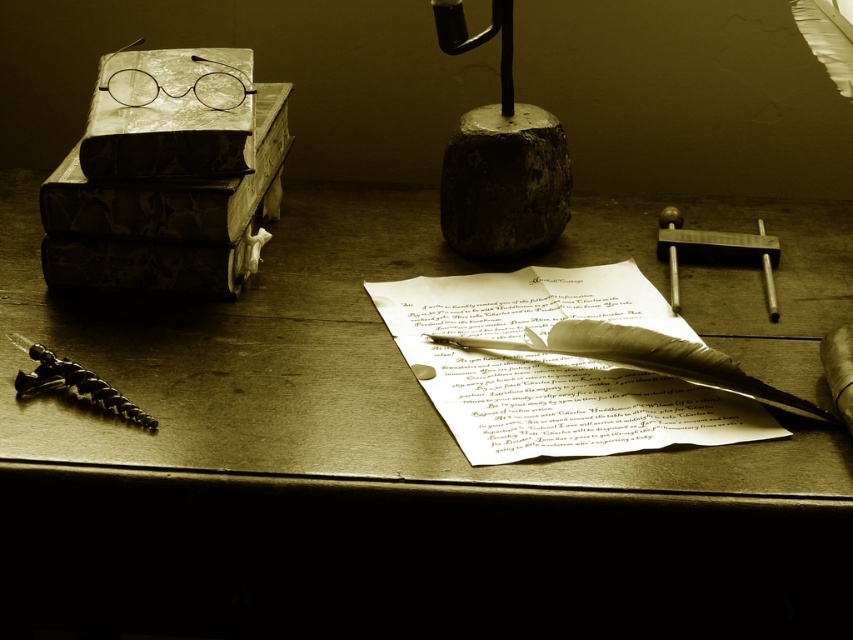
Question: Which of the following is the farthest from the observer?

Choices:
 (A) (22, 476)
 (B) (468, 124)

Answer: (B)

Question: Which point appears closest to the camera in this image?

Choices:
 (A) (13, 333)
 (B) (762, 262)
 (C) (460, 13)
 (D) (668, 435)

Answer: (D)

Question: Considering the real-world distances, which object is farthest from the white parchment paper at center?

Choices:
 (A) metallic spiral tool at lower left
 (B) dark gray stone at center
 (C) metallic polished hammer at right
 (D) wooden desk at center

Answer: (A)

Question: Is white parchment paper at center positioned before feather quill at center?

Choices:
 (A) yes
 (B) no

Answer: (A)

Question: Does wooden desk at center have a greater width compared to white parchment paper at center?

Choices:
 (A) yes
 (B) no

Answer: (A)

Question: Does dark gray stone at center lie in front of feather quill at center?

Choices:
 (A) no
 (B) yes

Answer: (A)